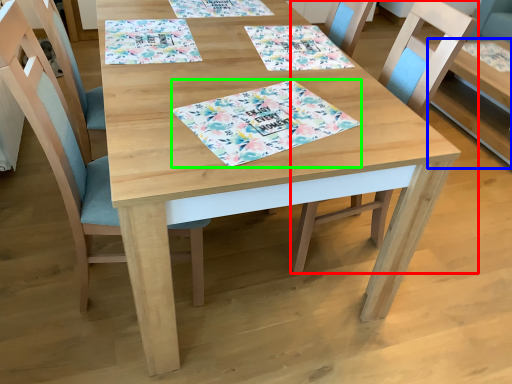
Question: Which is nearer to the chair (highlighted by a red box)? table (highlighted by a blue box) or place mat (highlighted by a green box).

Choices:
 (A) table
 (B) place mat

Answer: (B)